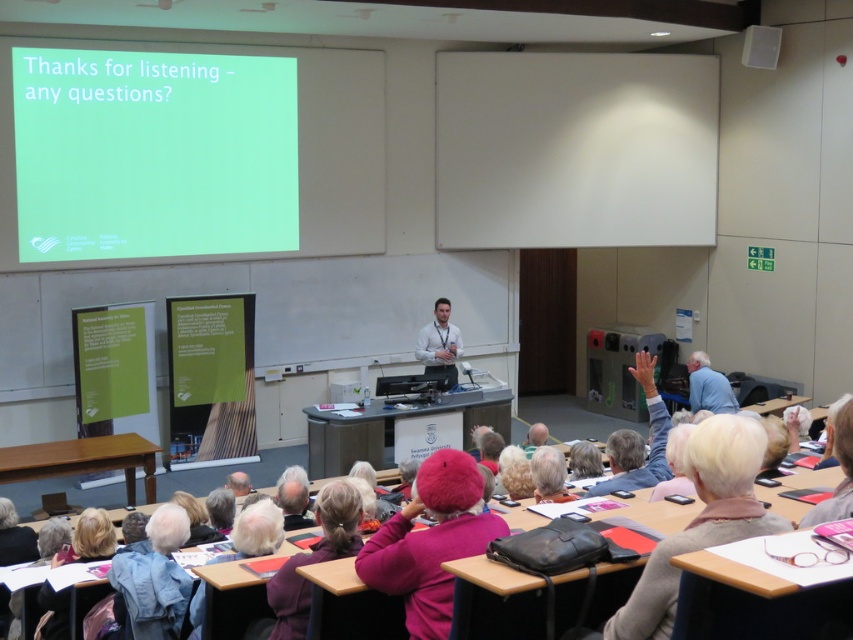
Question: Does denim jacket at lower left appear over light brown shirt at center?

Choices:
 (A) yes
 (B) no

Answer: (B)

Question: Is pink fabric at lower center below gray fabric jacket at lower right?

Choices:
 (A) no
 (B) yes

Answer: (B)

Question: Which of the following is the closest to the observer?

Choices:
 (A) (160, 595)
 (B) (695, 358)
 (C) (628, 604)
 (D) (625, 468)

Answer: (C)

Question: Estimate the real-world distances between objects in this image. Which object is closer to the pink fabric at lower center?

Choices:
 (A) blue fabric shirt at upper right
 (B) light brown sweater at lower right
 (C) light brown shirt at center
 (D) gray fabric jacket at lower right

Answer: (B)

Question: Does denim jacket at lower left have a smaller size compared to pink fabric at lower center?

Choices:
 (A) yes
 (B) no

Answer: (B)

Question: Which of the following is the farthest from the observer?

Choices:
 (A) (700, 406)
 (B) (627, 481)
 (C) (445, 326)
 (D) (720, 492)

Answer: (C)